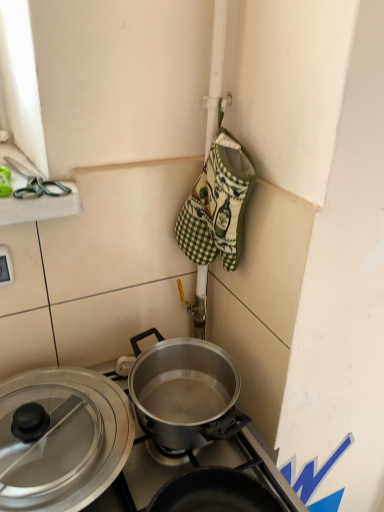
This screenshot has width=384, height=512. What are the coordinates of `green plastic scissors at upper left` in the screenshot? It's located at (36, 183).

Where is `transparent glass lid at lower left`? transparent glass lid at lower left is located at coordinates (64, 440).

Describe the element at coordinates (218, 205) in the screenshot. I see `green checkered oven mitt at center` at that location.

The image size is (384, 512). I want to click on green plastic scissors at upper left, so click(x=36, y=183).

Are polished silver pot at center and white plastic electric outlet at lower left located far from each other?

Actually, polished silver pot at center and white plastic electric outlet at lower left are a little close together.

Does point (72, 436) appear closer or farther from the camera than point (11, 273)?

Point (72, 436).

From the image's perspective, is polished silver pot at center above white plastic electric outlet at lower left?

No, from the image's perspective, polished silver pot at center is not above white plastic electric outlet at lower left.

Could you tell me if polished silver pot at center is turned towards white plastic electric outlet at lower left?

No, polished silver pot at center is not oriented towards white plastic electric outlet at lower left.

Which object is positioned more to the right, green plastic scissors at upper left or green checkered oven mitt at center?

green checkered oven mitt at center.

In the image, is green plastic scissors at upper left positioned in front of or behind green checkered oven mitt at center?

green plastic scissors at upper left is positioned closer to the viewer than green checkered oven mitt at center.

Which point is more distant from viewer, [30,184] or [191,196]?

The point [191,196] is farther from the camera.

From the image's perspective, is green plastic scissors at upper left above or below green checkered oven mitt at center?

green plastic scissors at upper left is above green checkered oven mitt at center.

Is transparent glass lid at lower left touching green plastic scissors at upper left?

No, transparent glass lid at lower left is not in contact with green plastic scissors at upper left.

How different are the orientations of transparent glass lid at lower left and green plastic scissors at upper left in degrees?

transparent glass lid at lower left and green plastic scissors at upper left are facing 3.31 degrees away from each other.

Considering the sizes of objects transparent glass lid at lower left and green plastic scissors at upper left in the image provided, who is shorter, transparent glass lid at lower left or green plastic scissors at upper left?

Standing shorter between the two is green plastic scissors at upper left.

Which point is more distant from viewer, (83, 493) or (56, 191)?

The point (56, 191) is farther from the camera.

In terms of size, does green checkered oven mitt at center appear bigger or smaller than transparent glass lid at lower left?

Considering their sizes, green checkered oven mitt at center takes up less space than transparent glass lid at lower left.

From the image's perspective, which one is positioned higher, green checkered oven mitt at center or transparent glass lid at lower left?

green checkered oven mitt at center appears higher in the image.

Based on the photo, considering the relative sizes of green checkered oven mitt at center and transparent glass lid at lower left in the image provided, is green checkered oven mitt at center wider than transparent glass lid at lower left?

Incorrect, the width of green checkered oven mitt at center does not surpass that of transparent glass lid at lower left.

Would you say green checkered oven mitt at center is to the left or to the right of transparent glass lid at lower left in the picture?

green checkered oven mitt at center is positioned on transparent glass lid at lower left's right side.

Looking at this image, is green checkered oven mitt at center situated inside green plastic scissors at upper left or outside?

green checkered oven mitt at center is not enclosed by green plastic scissors at upper left.

In order to click on material on the right of green plastic scissors at upper left in this screenshot , I will do `click(218, 205)`.

Looking at the image, does green checkered oven mitt at center seem bigger or smaller compared to green plastic scissors at upper left?

Considering their sizes, green checkered oven mitt at center takes up more space than green plastic scissors at upper left.

From the image's perspective, is polished silver pot at center positioned above or below transparent glass lid at lower left?

Based on their image positions, polished silver pot at center is located above transparent glass lid at lower left.

Is polished silver pot at center further to camera compared to transparent glass lid at lower left?

Yes, polished silver pot at center is further from the viewer.

Is polished silver pot at center smaller than transparent glass lid at lower left?

Incorrect, polished silver pot at center is not smaller in size than transparent glass lid at lower left.

Considering the sizes of white plastic electric outlet at lower left and transparent glass lid at lower left in the image, is white plastic electric outlet at lower left taller or shorter than transparent glass lid at lower left?

In the image, white plastic electric outlet at lower left appears to be shorter than transparent glass lid at lower left.

Identify the location of pot/pan to the right of white plastic electric outlet at lower left. (64, 440).

Considering the sizes of objects white plastic electric outlet at lower left and transparent glass lid at lower left in the image provided, who is wider, white plastic electric outlet at lower left or transparent glass lid at lower left?

With larger width is transparent glass lid at lower left.

Based on the photo, from the image's perspective, relative to transparent glass lid at lower left, is white plastic electric outlet at lower left above or below?

Based on their image positions, white plastic electric outlet at lower left is located above transparent glass lid at lower left.

The image size is (384, 512). Find the location of `electric outlet above the polished silver pot at center (from the image's perspective)`. electric outlet above the polished silver pot at center (from the image's perspective) is located at coordinates (6, 266).

Find the location of `scissors above the green checkered oven mitt at center (from a real-world perspective)`. scissors above the green checkered oven mitt at center (from a real-world perspective) is located at coordinates (36, 183).

Based on their spatial positions, is green plastic scissors at upper left or transparent glass lid at lower left closer to white plastic electric outlet at lower left?

green plastic scissors at upper left is positioned closer to the anchor white plastic electric outlet at lower left.

Considering their positions, is white plastic electric outlet at lower left positioned closer to transparent glass lid at lower left than polished silver pot at center?

polished silver pot at center lies closer to transparent glass lid at lower left than the other object.

Estimate the real-world distances between objects in this image. Which object is closer to polished silver pot at center, green checkered oven mitt at center or white plastic electric outlet at lower left?

Among the two, white plastic electric outlet at lower left is located nearer to polished silver pot at center.

Which object lies nearer to the anchor point white plastic electric outlet at lower left, green checkered oven mitt at center or transparent glass lid at lower left?

transparent glass lid at lower left is closer to white plastic electric outlet at lower left.

When comparing their distances from green checkered oven mitt at center, does polished silver pot at center or white plastic electric outlet at lower left seem closer?

Among the two, white plastic electric outlet at lower left is located nearer to green checkered oven mitt at center.

Looking at this image, considering their positions, is white plastic electric outlet at lower left positioned closer to green checkered oven mitt at center than green plastic scissors at upper left?

The object closer to green checkered oven mitt at center is green plastic scissors at upper left.

Estimate the real-world distances between objects in this image. Which object is closer to polished silver pot at center, white plastic electric outlet at lower left or green plastic scissors at upper left?

white plastic electric outlet at lower left is closer to polished silver pot at center.

Looking at this image, based on their spatial positions, is green plastic scissors at upper left or polished silver pot at center closer to transparent glass lid at lower left?

Among the two, polished silver pot at center is located nearer to transparent glass lid at lower left.

This screenshot has width=384, height=512. Identify the location of scissors between white plastic electric outlet at lower left and green checkered oven mitt at center in the horizontal direction. (36, 183).

Image resolution: width=384 pixels, height=512 pixels. In order to click on pot/pan between white plastic electric outlet at lower left and polished silver pot at center from left to right in this screenshot , I will do `click(64, 440)`.

The height and width of the screenshot is (512, 384). What are the coordinates of `material that lies between green plastic scissors at upper left and polished silver pot at center from top to bottom` in the screenshot? It's located at (218, 205).

Identify the location of material that lies between green plastic scissors at upper left and transparent glass lid at lower left from top to bottom. Image resolution: width=384 pixels, height=512 pixels. (218, 205).